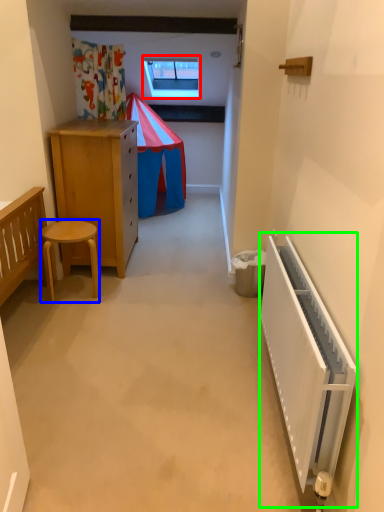
Question: Which is nearer to the window (highlighted by a red box)? stool (highlighted by a blue box) or radiator (highlighted by a green box).

Choices:
 (A) stool
 (B) radiator

Answer: (A)